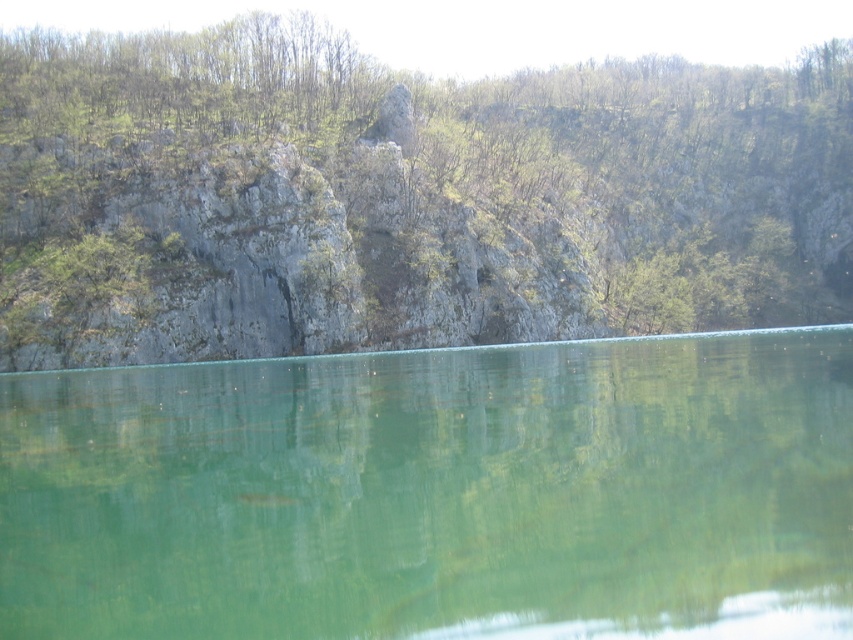
Does green glassy water at center have a larger size compared to green leafy trees at upper center?

Incorrect, green glassy water at center is not larger than green leafy trees at upper center.

Is point (498, 426) behind point (105, 120)?

No, it is in front of (105, 120).

Where is `green glassy water at center`? The image size is (853, 640). green glassy water at center is located at coordinates (437, 493).

Which is more to the left, green leafy tree at upper center or green glassy water at center?

Positioned to the left is green glassy water at center.

Is green leafy tree at upper center to the right of green glassy water at center from the viewer's perspective?

Correct, you'll find green leafy tree at upper center to the right of green glassy water at center.

Is point (837, 316) farther from camera compared to point (201, 561)?

That is True.

I want to click on green leafy tree at upper center, so click(402, 196).

Does green leafy tree at upper center appear under green leafy trees at upper center?

Incorrect, green leafy tree at upper center is not positioned below green leafy trees at upper center.

Which is more to the right, green leafy tree at upper center or green leafy trees at upper center?

green leafy tree at upper center is more to the right.

The image size is (853, 640). In order to click on green leafy tree at upper center in this screenshot , I will do `click(402, 196)`.

The width and height of the screenshot is (853, 640). In order to click on green leafy tree at upper center in this screenshot , I will do pos(402,196).